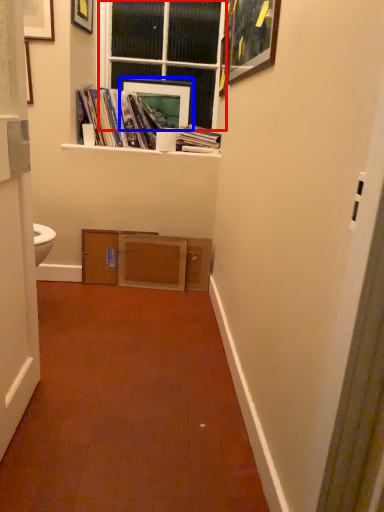
Question: Which of the following is the farthest to the observer, window (highlighted by a red box) or picture frame (highlighted by a blue box)?

Choices:
 (A) window
 (B) picture frame

Answer: (B)